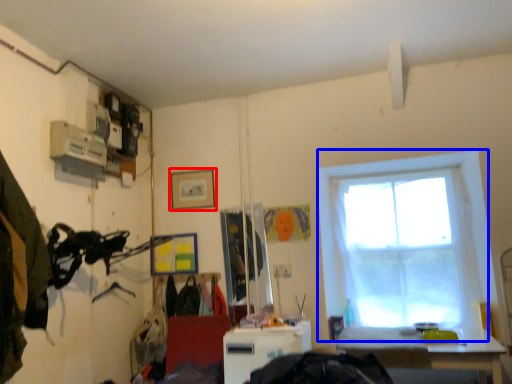
Question: Which object is further to the camera taking this photo, picture frame (highlighted by a red box) or window (highlighted by a blue box)?

Choices:
 (A) picture frame
 (B) window

Answer: (A)